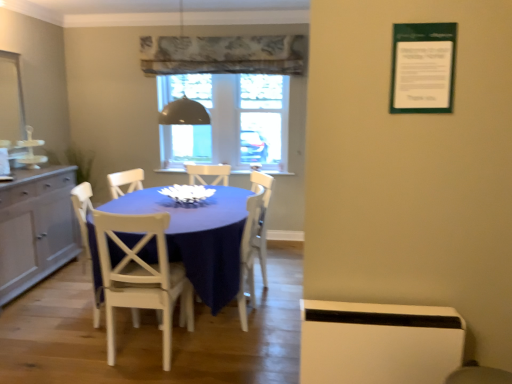
Question: Is black glass dome at center, which appears as the second window screen when viewed from the right, wider or thinner than transparent glass window at center, positioned as the second window screen in left-to-right order?

Choices:
 (A) wide
 (B) thin

Answer: (B)

Question: Choose the correct answer: Is black glass dome at center, which appears as the second window screen when viewed from the right, inside transparent glass window at center, positioned as the second window screen in left-to-right order, or outside it?

Choices:
 (A) outside
 (B) inside

Answer: (A)

Question: Which object is the closest to the white painted wood chair at center, the second chair from the right?

Choices:
 (A) blue fabric table at center
 (B) metallic dome at upper center
 (C) white wood chair at center, which ranks as the first chair in back-to-front order
 (D) black glass dome at center, which is the first window screen in left-to-right order
 (E) matte gray cabinet at left

Answer: (A)

Question: Considering the real-world distances, which object is farthest from the black glass dome at center, which is the first window screen in left-to-right order?

Choices:
 (A) blue fabric table at center
 (B) white wood chair at center, acting as the second chair starting from the back
 (C) white wood chair at center, the 1th chair in the right-to-left sequence
 (D) white painted wood chair at center, which ranks as the third chair in back-to-front order
 (E) matte gray cabinet at left

Answer: (D)